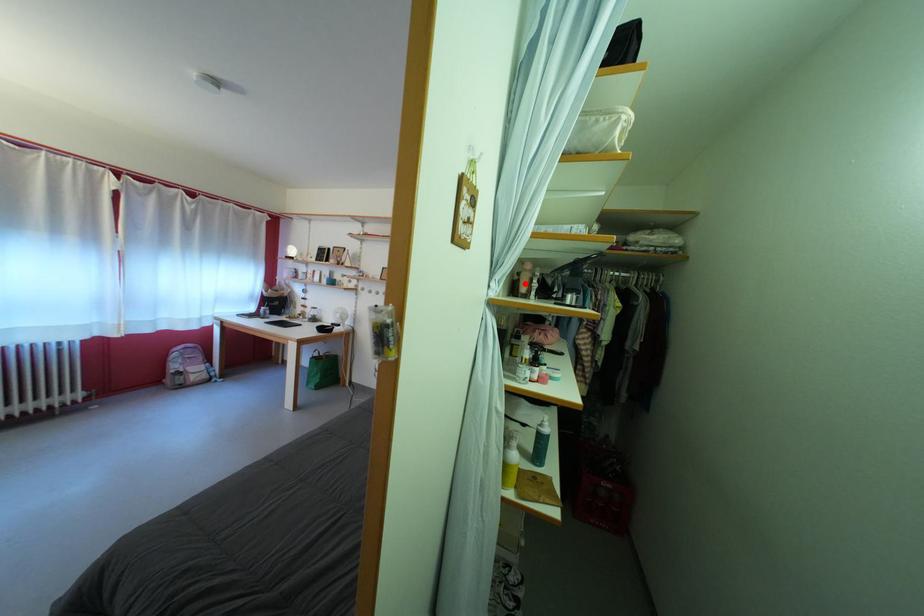
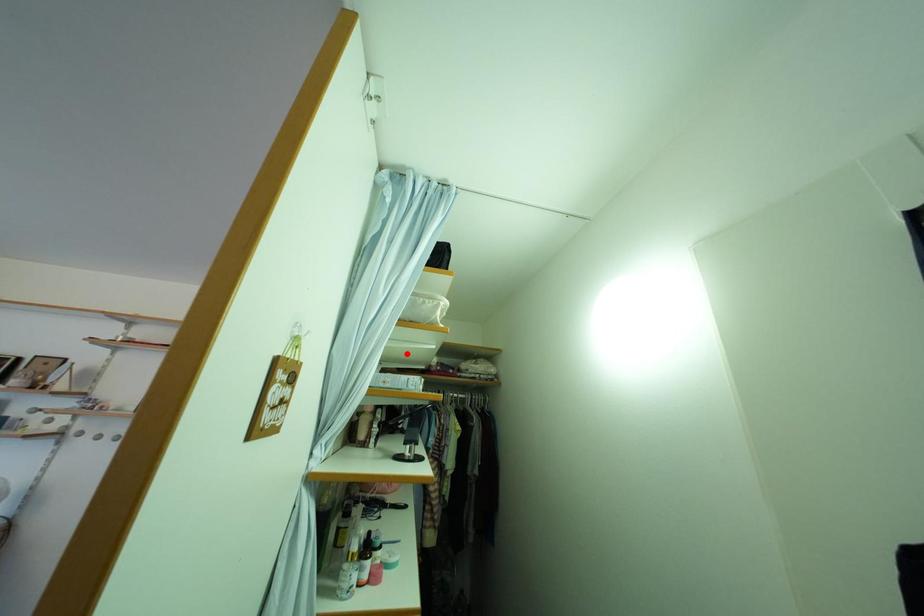
I am providing you with two images of the same scene from different viewpoints. A red point is marked on the first image and another point is marked on the second image. Is the marked point in image1 the same physical position as the marked point in image2?

No